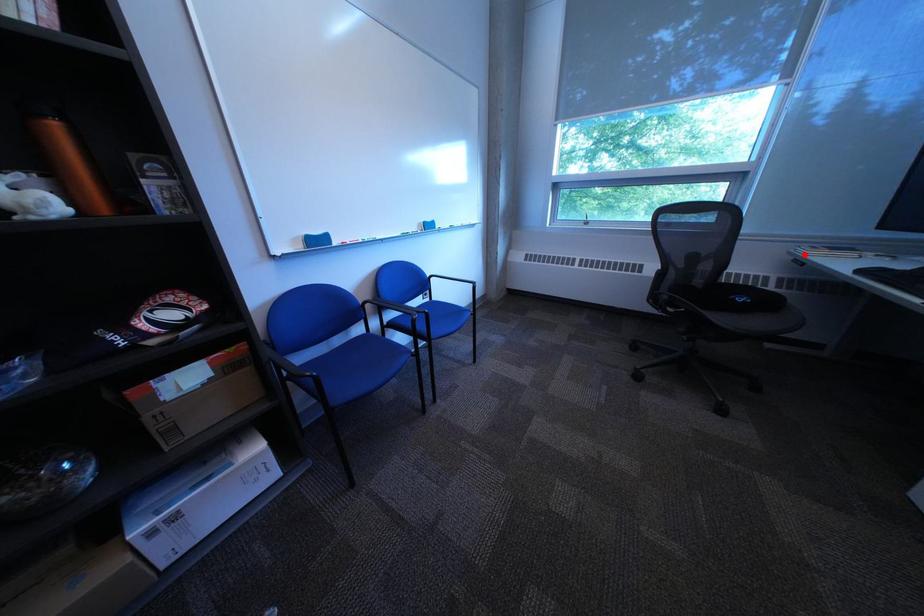
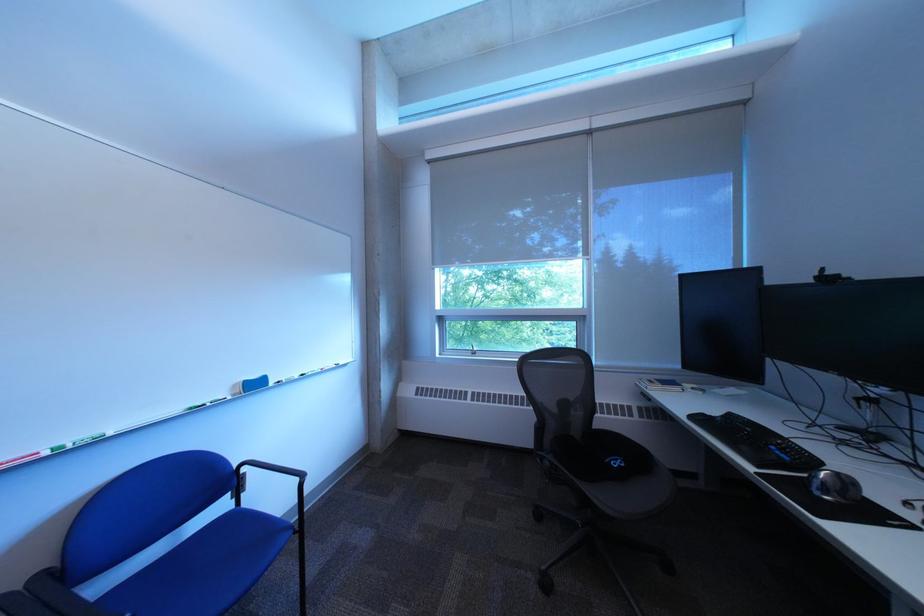
Question: I am providing you with two images of the same scene from different viewpoints. A red point is marked on the first image. Is the red point's position out of view in image 2?

Choices:
 (A) Yes
 (B) No

Answer: (B)